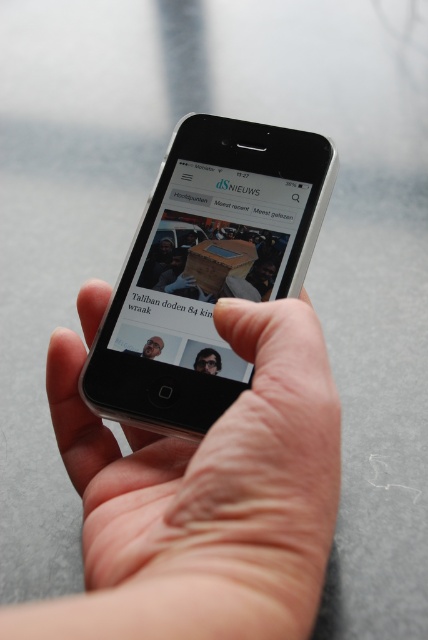
What do you see at coordinates (205, 268) in the screenshot? The width and height of the screenshot is (428, 640). I see `silver metallic smartphone at center` at bounding box center [205, 268].

Can you confirm if silver metallic smartphone at center is shorter than matte black glasses at center?

In fact, silver metallic smartphone at center may be taller than matte black glasses at center.

Between point (232, 120) and point (202, 368), which one is positioned in front?

Point (202, 368) is more forward.

Identify the location of silver metallic smartphone at center. The height and width of the screenshot is (640, 428). (205, 268).

Based on the photo, does skinny white hand at center have a lesser height compared to matte black glasses at center?

Incorrect, skinny white hand at center's height does not fall short of matte black glasses at center's.

Is skinny white hand at center positioned in front of matte black glasses at center?

Yes, it is in front of matte black glasses at center.

What do you see at coordinates (207, 496) in the screenshot? I see `skinny white hand at center` at bounding box center [207, 496].

The width and height of the screenshot is (428, 640). Find the location of `skinny white hand at center`. skinny white hand at center is located at coordinates (207, 496).

Does point (225, 618) lie in front of point (155, 355)?

Yes, it is in front of point (155, 355).

Which of these two, skinny white hand at center or silver metallic smartphone at center, stands taller?

silver metallic smartphone at center

Describe the element at coordinates (207, 496) in the screenshot. I see `skinny white hand at center` at that location.

Identify the location of skinny white hand at center. (207, 496).